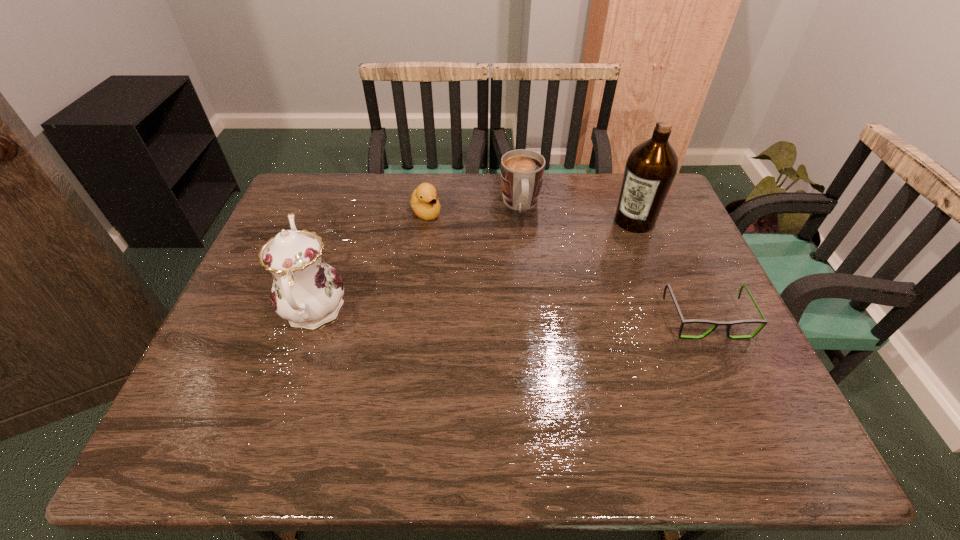
This screenshot has width=960, height=540. What are the coordinates of `free spot located facing forward on the second object from left to right` in the screenshot? It's located at (468, 268).

Locate an element on the screen. This screenshot has width=960, height=540. vacant position located 0.080m facing forward on the second object from left to right is located at coordinates (444, 239).

Where is `free point located facing forward on the second object from left to right`? free point located facing forward on the second object from left to right is located at coordinates (449, 245).

The width and height of the screenshot is (960, 540). I want to click on free space located on the label of the tallest object, so click(x=563, y=303).

Identify the location of vacant space located on the label of the tallest object. (567, 299).

Locate an element on the screen. This screenshot has height=540, width=960. vacant position located on the label of the tallest object is located at coordinates (587, 276).

The image size is (960, 540). Find the location of `free space located 0.320m on the side of the third object from right to left with the handle`. free space located 0.320m on the side of the third object from right to left with the handle is located at coordinates (532, 306).

The image size is (960, 540). Find the location of `vacant position located 0.210m on the side of the third object from right to left with the handle`. vacant position located 0.210m on the side of the third object from right to left with the handle is located at coordinates (528, 275).

You are a GUI agent. You are given a task and a screenshot of the screen. Output one action in this format:
    pyautogui.click(x=<x>, y=<y>)
    Task: Click on the free space located 0.110m on the side of the third object from right to left with the handle
    
    Given the screenshot: What is the action you would take?
    pyautogui.click(x=525, y=249)

You are a GUI agent. You are given a task and a screenshot of the screen. Output one action in this format:
    pyautogui.click(x=<x>, y=<y>)
    Task: Click on the duckling that is positioned at the far edge
    The height and width of the screenshot is (540, 960).
    Given the screenshot: What is the action you would take?
    click(426, 206)